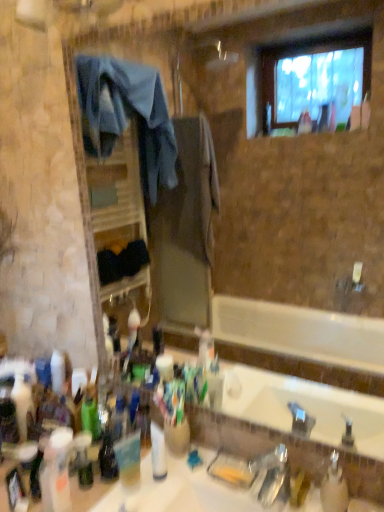
Question: From the image's perspective, is white glossy sink at center located above or below green matte bottle at lower left, which is the 4th bottle from right to left?

Choices:
 (A) above
 (B) below

Answer: (B)

Question: In terms of size, does white glossy sink at center appear bigger or smaller than green matte bottle at lower left, which appears as the 1th bottle when viewed from the back?

Choices:
 (A) small
 (B) big

Answer: (B)

Question: Estimate the real-world distances between objects in this image. Which object is farther from the metallic silver faucet at lower center?

Choices:
 (A) white glossy bottle at center, positioned as the third bottle in front-to-back order
 (B) translucent plastic bottle at lower left, the third bottle when ordered from right to left
 (C) green matte bottle at lower left, which is counted as the 5th bottle, starting from the front
 (D) translucent plastic bottle at lower left, the second toiletry positioned from the right
 (E) yellow matte soap dispenser at lower right, the first toiletry viewed from the right

Answer: (C)

Question: Based on their relative distances, which object is nearer to the white glossy bottle at center, the 2th bottle positioned from the right?

Choices:
 (A) translucent plastic bottle at lower left, which is the 2th bottle in back-to-front order
 (B) translucent plastic bottle at lower left, which is counted as the third toiletry, starting from the right
 (C) clear plastic bottle at lower right, which appears as the 5th bottle when viewed from the left
 (D) translucent plastic cup at lower center
 (E) translucent plastic bottle at lower left, the second toiletry from the left

Answer: (D)